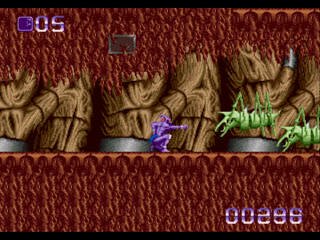
This screenshot has height=240, width=320. I want to click on red upper walls, so click(19, 60), click(9, 19), click(73, 60), click(92, 24), click(179, 33), click(213, 14), click(275, 36), click(304, 38).